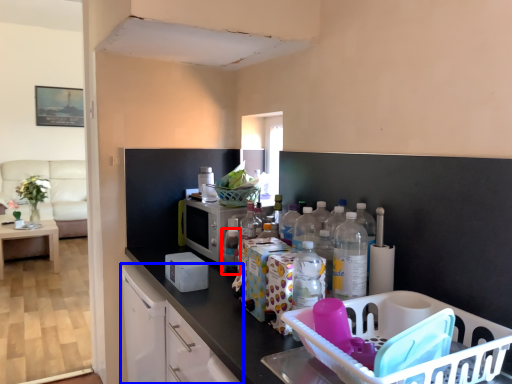
Question: Which object is further to the camera taking this photo, bottle (highlighted by a red box) or cabinetry (highlighted by a blue box)?

Choices:
 (A) bottle
 (B) cabinetry

Answer: (A)